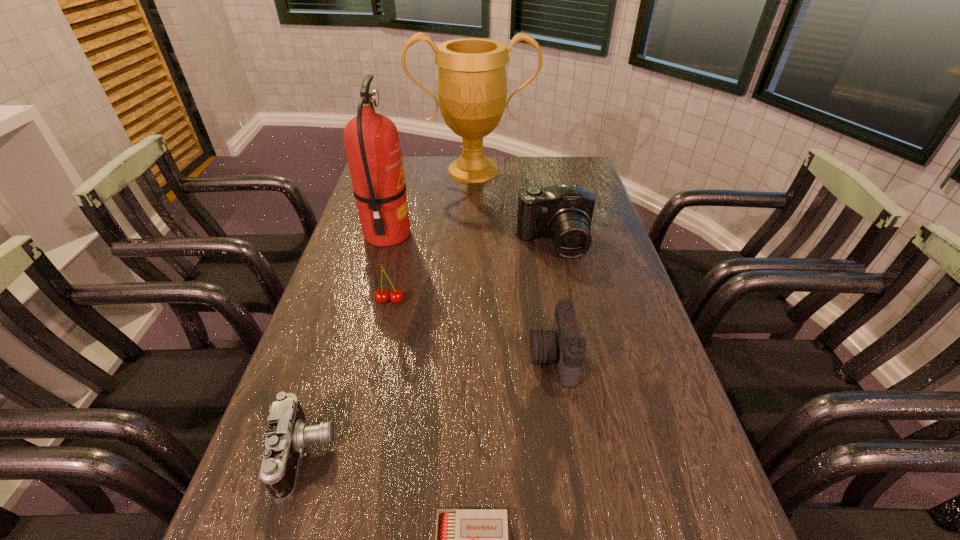
The height and width of the screenshot is (540, 960). I want to click on free spot between the farthest camera and the farthest object, so click(x=514, y=207).

In order to click on free space between the trophy and the shortest camera in this screenshot , I will do `click(389, 312)`.

You are a GUI agent. You are given a task and a screenshot of the screen. Output one action in this format:
    pyautogui.click(x=<x>, y=<y>)
    Task: Click on the vacant space that is in between the tallest camera and the leftmost camera
    The height and width of the screenshot is (540, 960).
    Given the screenshot: What is the action you would take?
    pyautogui.click(x=430, y=349)

Identify the location of free space between the fifth shortest object and the trophy. The height and width of the screenshot is (540, 960). (514, 207).

You are a GUI agent. You are given a task and a screenshot of the screen. Output one action in this format:
    pyautogui.click(x=<x>, y=<y>)
    Task: Click on the free space between the tallest camera and the fifth farthest object
    The width and height of the screenshot is (960, 540).
    Given the screenshot: What is the action you would take?
    pyautogui.click(x=554, y=300)

This screenshot has height=540, width=960. What are the coordinates of `empty space between the shortest camera and the cherry` in the screenshot? It's located at 348,377.

Where is `object identified as the sixth closest to the fifth farthest object`? object identified as the sixth closest to the fifth farthest object is located at coordinates (472, 88).

Select which object is the closest to the shortest object. Please provide its 2D coordinates. Your answer should be formatted as a tuple, i.e. [(x, y)], where the tuple contains the x and y coordinates of a point satisfying the conditions above.

[(287, 434)]

Select which camera appears as the closest to the fifth farthest object. Please provide its 2D coordinates. Your answer should be formatted as a tuple, i.e. [(x, y)], where the tuple contains the x and y coordinates of a point satisfying the conditions above.

[(563, 212)]

Identify which camera is located as the nearest to the matchbox. Please provide its 2D coordinates. Your answer should be formatted as a tuple, i.e. [(x, y)], where the tuple contains the x and y coordinates of a point satisfying the conditions above.

[(287, 434)]